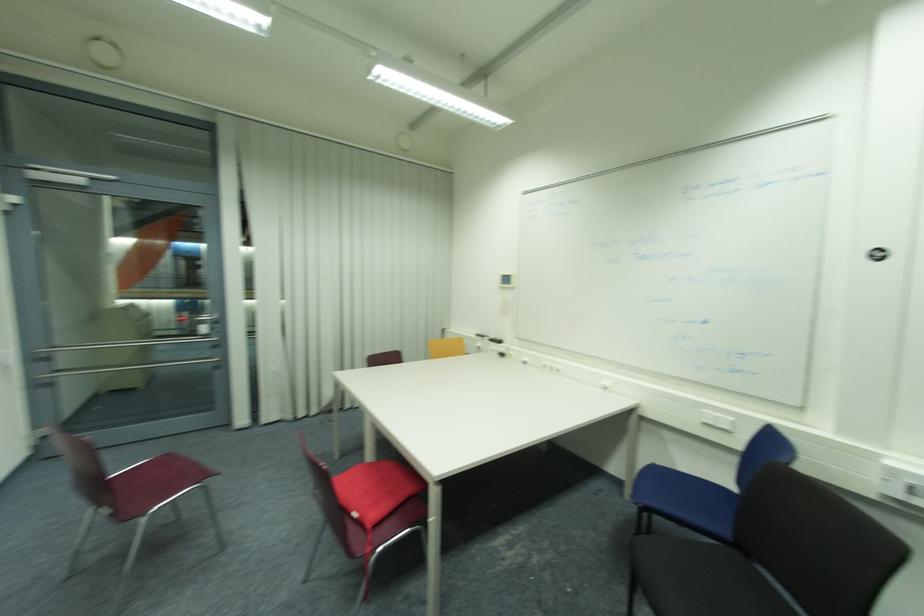
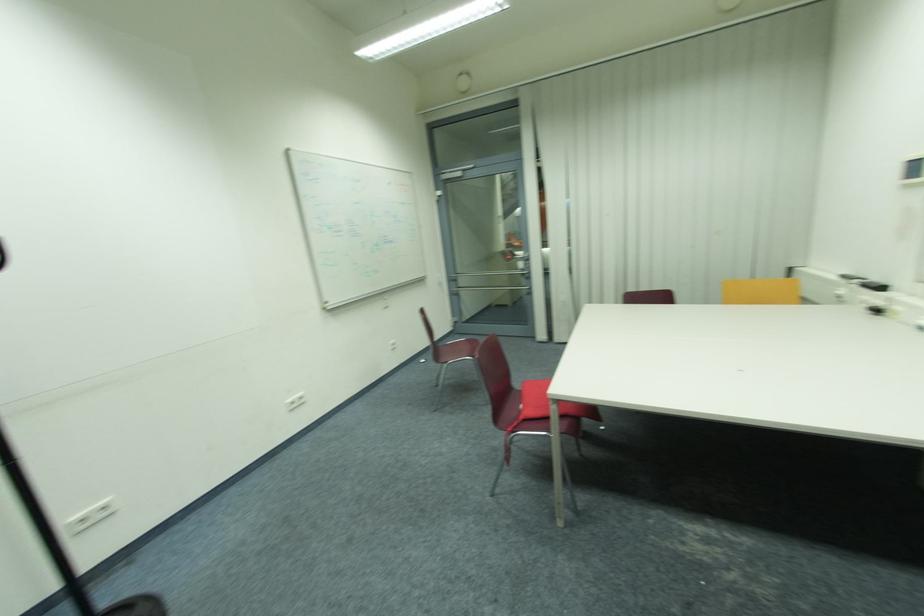
Question: Based on the continuous images, in which direction is the camera rotating? Reply with the corresponding letter.

Choices:
 (A) Left
 (B) Right
 (C) Up
 (D) Down

Answer: (A)